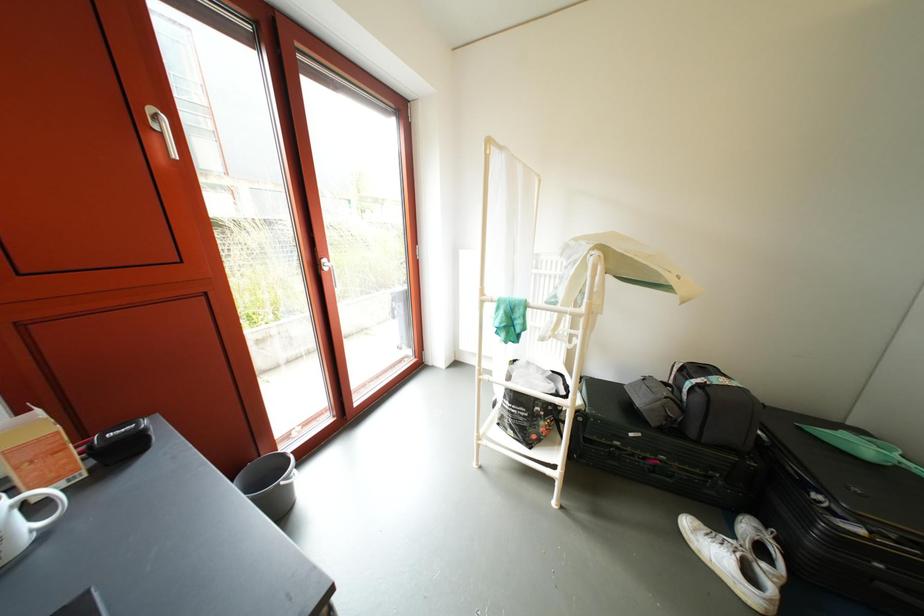
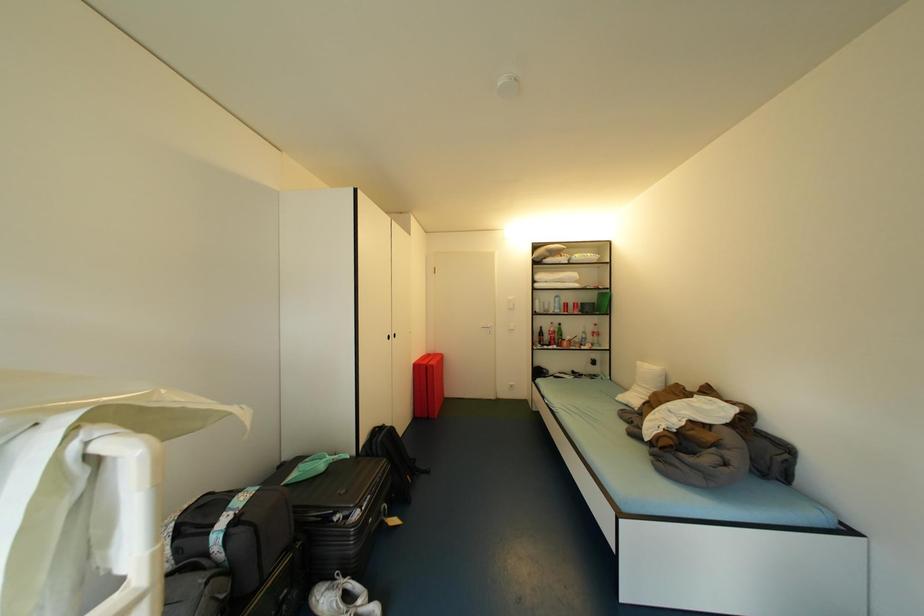
Question: The first image is from the beginning of the video and the second image is from the end. How did the camera likely rotate when shooting the video?

Choices:
 (A) Left
 (B) Right
 (C) Up
 (D) Down

Answer: (B)